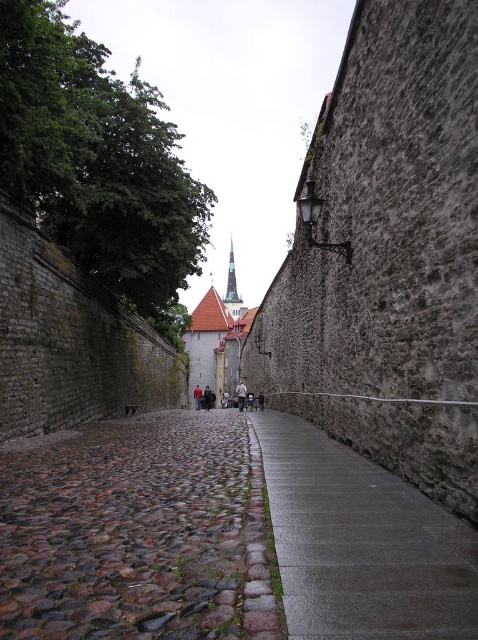
From the picture: You are standing at the entrance of the narrow cobblestone street and see two points marked in the scene. The first point is at coordinates point (131, 525) and the second point is at point (227, 300). Which point is closer to you as you face the street?

Point (131, 525) is closer to you because it is in front of point (227, 300) in the scene.

You are a delivery person with a cart that requires a wide path. You see the brown cobblestone pavement at center and the gray concrete pavement at center. Which pavement should you choose to ensure your cart can pass through comfortably?

The brown cobblestone pavement at center is bigger than the gray concrete pavement at center, so you should choose the brown cobblestone pavement at center for your cart to pass through comfortably.